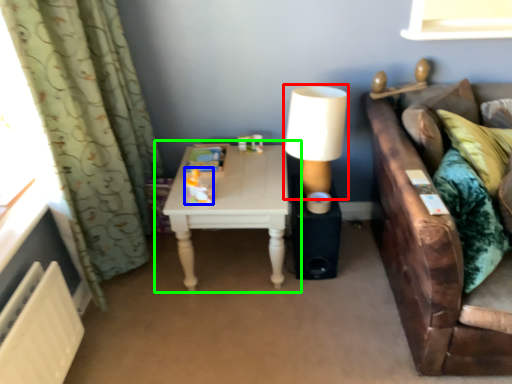
Question: Which object is the closest to the table lamp (highlighted by a red box)? Choose among these: toy (highlighted by a blue box) or table (highlighted by a green box).

Choices:
 (A) toy
 (B) table

Answer: (B)